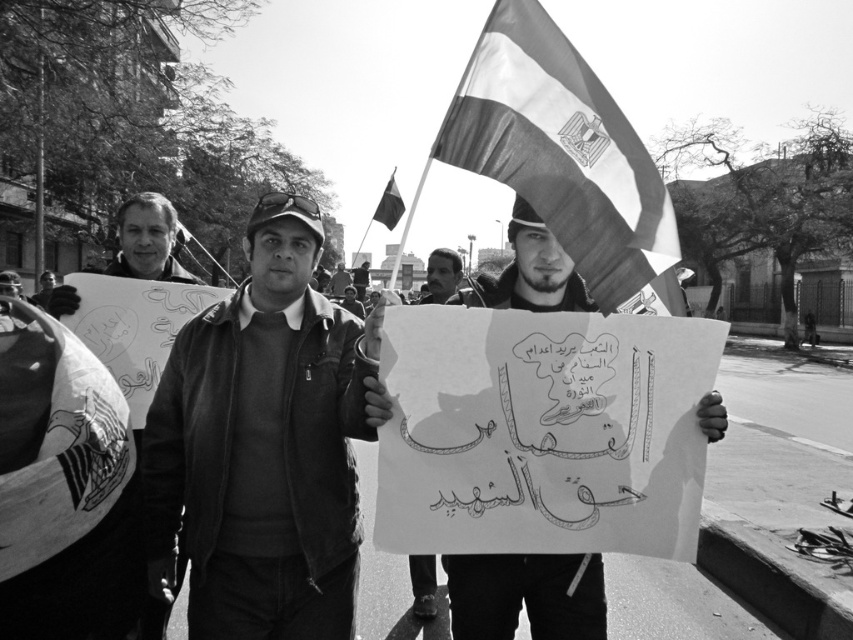
Question: Does dark gray leather jacket at center have a lesser width compared to smooth paper sign at center?

Choices:
 (A) yes
 (B) no

Answer: (B)

Question: Which of the following is the farthest from the observer?

Choices:
 (A) click(338, 275)
 (B) click(380, 198)
 (C) click(474, 602)

Answer: (A)

Question: Which point appears closest to the camera in this image?

Choices:
 (A) (426, 588)
 (B) (496, 564)
 (C) (172, 259)
 (D) (375, 307)

Answer: (D)

Question: Can you confirm if smooth black shirt at center is positioned above smooth paper sign at center?

Choices:
 (A) yes
 (B) no

Answer: (A)

Question: Does dark gray leather jacket at center appear on the left side of smooth black shirt at center?

Choices:
 (A) yes
 (B) no

Answer: (B)

Question: Which object is closer to the camera taking this photo?

Choices:
 (A) smooth black shirt at center
 (B) textured fabric flag at upper center

Answer: (B)